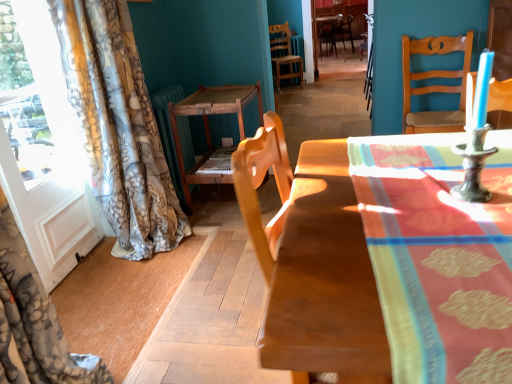
The image size is (512, 384). I want to click on free space to the left of metallic candle holder at right, so click(x=392, y=204).